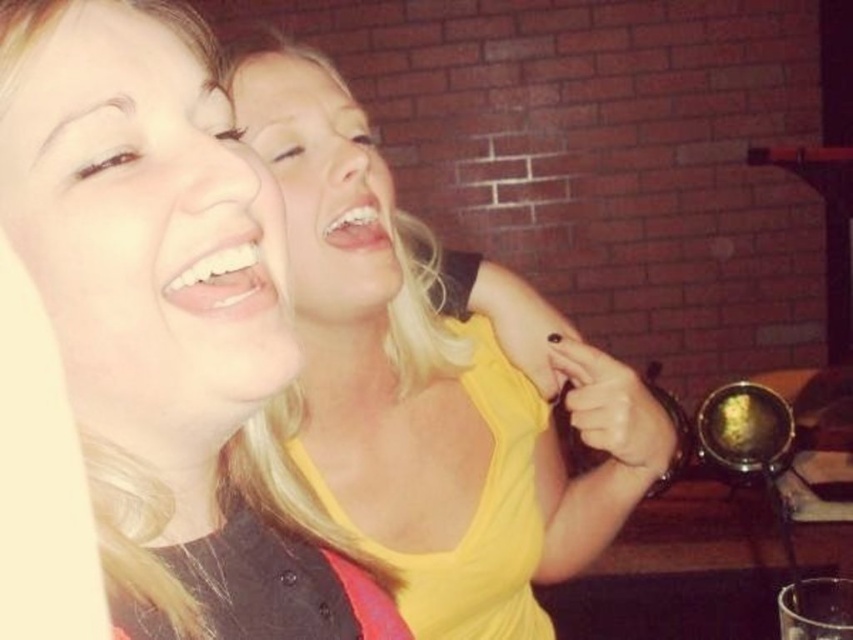
You are a photographer adjusting the lighting in the scene. You need to ensure that both the yellow matte tank top at upper center and the yellow matte tank top at center are equally illuminated. Given their positions, which one might naturally receive more light and why?

The yellow matte tank top at upper center is positioned over the yellow matte tank top at center, so it might naturally receive more light because it is higher and closer to the light source, potentially casting a shadow on the lower one.

In the scene shown: You are trying to locate the yellow matte tank top at upper center in the image. Based on the coordinates provided, can you determine its position relative to the center of the image?

The yellow matte tank top at upper center is located at point coordinates approximately 0.494 along the x axis and 0.191 along the y axis, meaning it is very close to the center horizontally and slightly below the vertical center of the image.